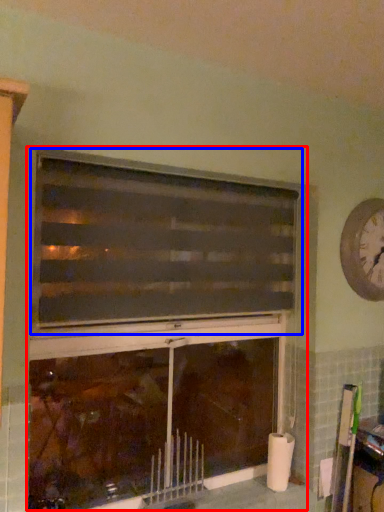
Question: Which object appears closest to the camera in this image, fireplace (highlighted by a red box) or window (highlighted by a blue box)?

Choices:
 (A) fireplace
 (B) window

Answer: (B)